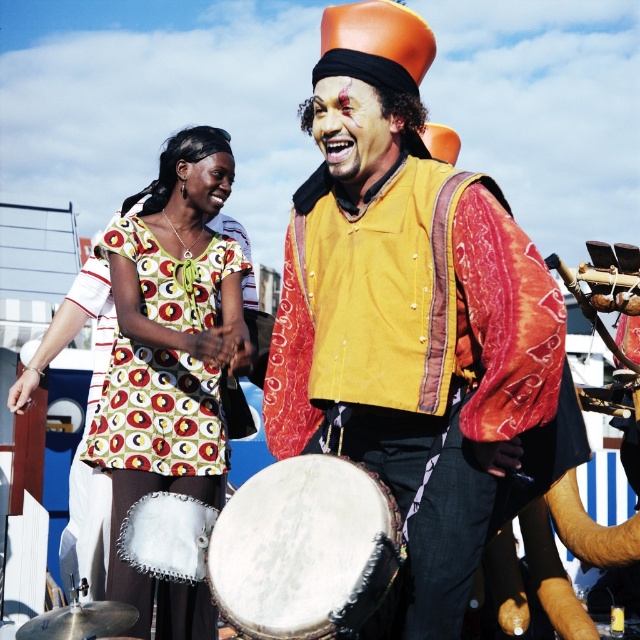
Question: Is white leather drum at center smaller than matte orange helmet at center?

Choices:
 (A) yes
 (B) no

Answer: (A)

Question: Which of these objects is positioned farthest from the white leather drum at center?

Choices:
 (A) matte yellow vest at center
 (B) matte skin face at center
 (C) printed fabric dress at center
 (D) printed fabric dress at left

Answer: (B)

Question: Estimate the real-world distances between objects in this image. Which object is closer to the printed fabric dress at left?

Choices:
 (A) printed fabric dress at center
 (B) matte skin face at center
 (C) white leather drum at center

Answer: (A)

Question: Does matte yellow vest at center have a smaller size compared to printed fabric dress at left?

Choices:
 (A) yes
 (B) no

Answer: (B)

Question: Can you confirm if printed fabric dress at center is bigger than matte orange helmet at center?

Choices:
 (A) no
 (B) yes

Answer: (B)

Question: Which point is farther from the camera taking this photo?

Choices:
 (A) (323, 577)
 (B) (92, 444)
 (C) (392, 355)
 (D) (205, 189)

Answer: (D)